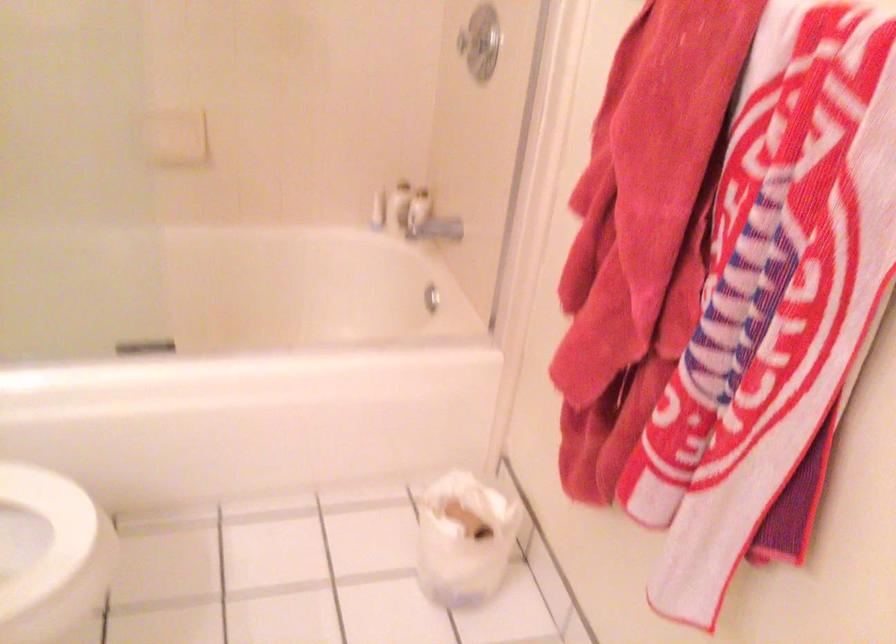
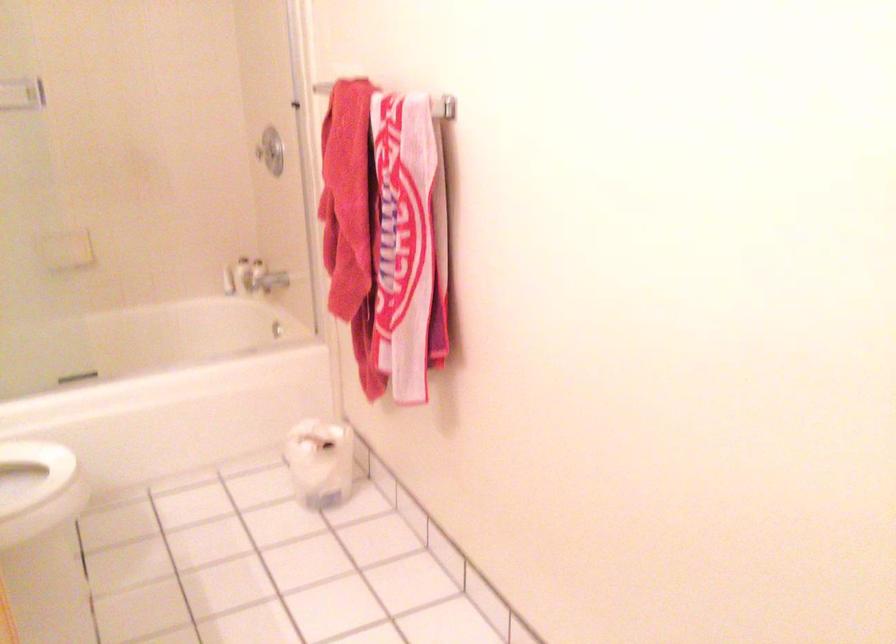
Question: What movement of the cameraman would produce the second image?

Choices:
 (A) Left
 (B) Right
 (C) Forward
 (D) Backward

Answer: (D)